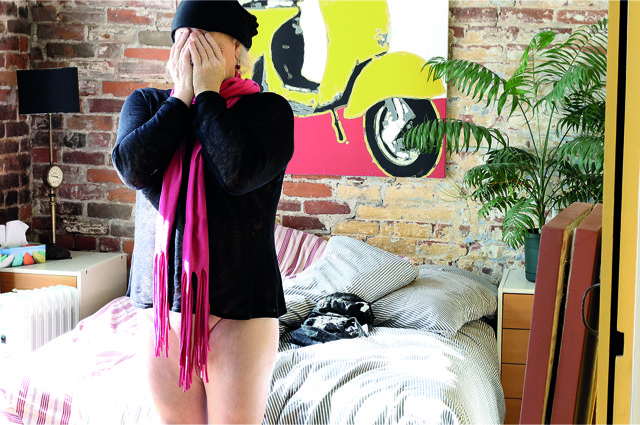
At what (x,y) coordinates should I click in order to perform the action: click on comforter. Please return your answer as a coordinate pair (x, y). Looking at the image, I should click on (394, 375).